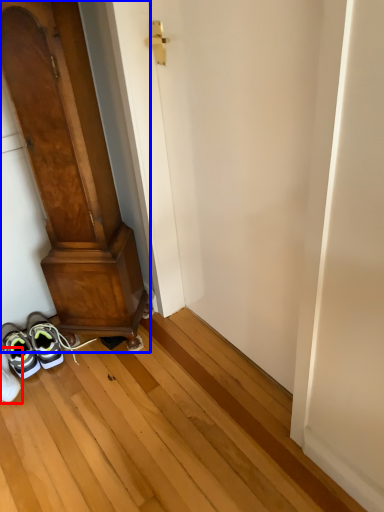
Question: Which object is further to the camera taking this photo, footwear (highlighted by a red box) or door (highlighted by a blue box)?

Choices:
 (A) footwear
 (B) door

Answer: (A)